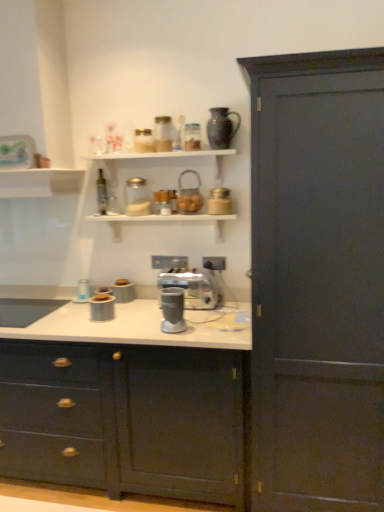
Question: Does matte glass jar at center, the third appliance viewed from the top, have a greater height compared to metallic silver blender at center?

Choices:
 (A) yes
 (B) no

Answer: (B)

Question: Does matte glass jar at center, which ranks as the 3th appliance in bottom-to-top order, appear on the right side of metallic silver blender at center?

Choices:
 (A) yes
 (B) no

Answer: (A)

Question: From the image's perspective, would you say matte glass jar at center, the third appliance viewed from the top, is positioned over metallic silver blender at center?

Choices:
 (A) no
 (B) yes

Answer: (B)

Question: Does matte glass jar at center, which appears as the first appliance when viewed from the right, have a larger size compared to metallic silver blender at center?

Choices:
 (A) yes
 (B) no

Answer: (B)

Question: Does matte glass jar at center, which ranks as the 3th appliance in bottom-to-top order, lie in front of metallic silver blender at center?

Choices:
 (A) no
 (B) yes

Answer: (B)

Question: Can you confirm if matte glass jar at center, the fifth appliance positioned from the left, is thinner than metallic silver blender at center?

Choices:
 (A) yes
 (B) no

Answer: (A)

Question: Is matte plastic container at center, which is counted as the 5th appliance, starting from the top, positioned beyond the bounds of matte dark wood cabinet at right, the 2th cabinetry positioned from the left?

Choices:
 (A) yes
 (B) no

Answer: (A)

Question: Does matte plastic container at center, which is counted as the 5th appliance, starting from the top, have a larger size compared to matte dark wood cabinet at right, marked as the 1th cabinetry in a right-to-left arrangement?

Choices:
 (A) yes
 (B) no

Answer: (B)

Question: Is matte plastic container at center, placed as the first appliance when sorted from left to right, touching matte dark wood cabinet at right, the 2th cabinetry positioned from the left?

Choices:
 (A) no
 (B) yes

Answer: (A)

Question: Is matte plastic container at center, which is counted as the 5th appliance, starting from the top, taller than matte dark wood cabinet at right, the 2th cabinetry positioned from the left?

Choices:
 (A) yes
 (B) no

Answer: (B)

Question: Can you confirm if matte plastic container at center, placed as the first appliance when sorted from left to right, is thinner than matte dark wood cabinet at right, marked as the 1th cabinetry in a right-to-left arrangement?

Choices:
 (A) no
 (B) yes

Answer: (B)

Question: Is matte plastic container at center, placed as the first appliance when sorted from left to right, facing away from matte dark wood cabinet at right, the 2th cabinetry positioned from the left?

Choices:
 (A) yes
 (B) no

Answer: (B)

Question: Are matte black vase at upper center and matte dark wood cabinet at right, the 2th cabinetry positioned from the left, far apart?

Choices:
 (A) yes
 (B) no

Answer: (A)